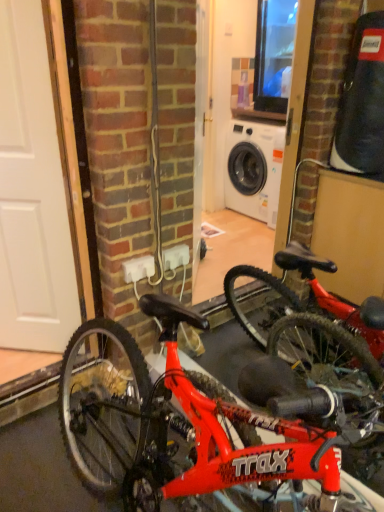
Locate an element on the screen. The image size is (384, 512). white matte door at left is located at coordinates (32, 193).

What do you see at coordinates (138, 268) in the screenshot? I see `white plastic electric outlet at center` at bounding box center [138, 268].

Find the location of a particular element. white plastic electric outlet at center is located at coordinates (138, 268).

Find the location of a particular element. The height and width of the screenshot is (512, 384). shiny red bicycle at center is located at coordinates (211, 415).

Between shiny red bicycle at center and white plastic electric outlet at center, which one appears on the right side from the viewer's perspective?

shiny red bicycle at center.

Is shiny red bicycle at center spatially inside white plastic electric outlet at center, or outside of it?

shiny red bicycle at center exists outside the volume of white plastic electric outlet at center.

Is shiny red bicycle at center far from white plastic electric outlet at center?

No, shiny red bicycle at center is not far from white plastic electric outlet at center.

From the image's perspective, is shiny red bicycle at center under white plastic electric outlet at center?

Indeed, from the image's perspective, shiny red bicycle at center is shown beneath white plastic electric outlet at center.

In the image, is white matte door at left on the left side or the right side of white plastic electric outlet at center?

white matte door at left is positioned on white plastic electric outlet at center's left side.

Is the position of white matte door at left less distant than that of white plastic electric outlet at center?

Yes, white matte door at left is in front of white plastic electric outlet at center.

Considering the relative sizes of white matte door at left and white plastic electric outlet at center in the image provided, is white matte door at left taller than white plastic electric outlet at center?

Yes.

Is shiny red bicycle at center positioned beyond the bounds of white matte door at left?

Indeed, shiny red bicycle at center is completely outside white matte door at left.

Where is `bicycle below the white matte door at left (from the image's perspective)`? Image resolution: width=384 pixels, height=512 pixels. bicycle below the white matte door at left (from the image's perspective) is located at coordinates (211, 415).

Is white plastic electric outlet at center beside shiny red bicycle at center?

No, white plastic electric outlet at center is not next to shiny red bicycle at center.

Consider the image. Considering the sizes of objects white plastic electric outlet at center and shiny red bicycle at center in the image provided, who is taller, white plastic electric outlet at center or shiny red bicycle at center?

Standing taller between the two is shiny red bicycle at center.

In the scene shown: Between white plastic electric outlet at center and shiny red bicycle at center, which one has larger width?

With larger width is shiny red bicycle at center.

From a real-world perspective, which object rests below the other?

shiny red bicycle at center.

Does white plastic electric outlet at center lie behind white matte door at left?

Yes, the depth of white plastic electric outlet at center is greater than that of white matte door at left.

How far apart are white plastic electric outlet at center and white matte door at left?

The distance of white plastic electric outlet at center from white matte door at left is 20.30 inches.

Can you confirm if white plastic electric outlet at center is wider than white matte door at left?

No.

Is white plastic electric outlet at center at the left side of white matte door at left?

No, white plastic electric outlet at center is not to the left of white matte door at left.

In the scene shown: Between white matte door at left and shiny red bicycle at center, which one has smaller size?

white matte door at left.

Is white matte door at left aimed at shiny red bicycle at center?

No, white matte door at left is not turned towards shiny red bicycle at center.

Considering the sizes of white matte door at left and shiny red bicycle at center in the image, is white matte door at left taller or shorter than shiny red bicycle at center?

Clearly, white matte door at left is taller compared to shiny red bicycle at center.

This screenshot has width=384, height=512. What are the coordinates of `bicycle that is under the white plastic electric outlet at center (from a real-world perspective)` in the screenshot? It's located at (211, 415).

Locate an element on the screen. This screenshot has width=384, height=512. door above the white plastic electric outlet at center (from the image's perspective) is located at coordinates (32, 193).

Considering their positions, is white matte door at left positioned closer to white plastic electric outlet at center than shiny red bicycle at center?

The object closer to white plastic electric outlet at center is white matte door at left.

Estimate the real-world distances between objects in this image. Which object is further from shiny red bicycle at center, white matte door at left or white plastic electric outlet at center?

Among the two, white matte door at left is located further to shiny red bicycle at center.

When comparing their distances from shiny red bicycle at center, does white plastic electric outlet at center or white matte door at left seem closer?

white plastic electric outlet at center is positioned closer to the anchor shiny red bicycle at center.

Considering their positions, is shiny red bicycle at center positioned closer to white plastic electric outlet at center than white matte door at left?

white matte door at left is closer to white plastic electric outlet at center.

Estimate the real-world distances between objects in this image. Which object is further from white matte door at left, shiny red bicycle at center or white plastic electric outlet at center?

Based on the image, shiny red bicycle at center appears to be further to white matte door at left.

Based on their spatial positions, is white plastic electric outlet at center or shiny red bicycle at center closer to white matte door at left?

white plastic electric outlet at center is closer to white matte door at left.

At what (x,y) coordinates should I click in order to perform the action: click on door between shiny red bicycle at center and white plastic electric outlet at center from front to back. Please return your answer as a coordinate pair (x, y). Looking at the image, I should click on (32, 193).